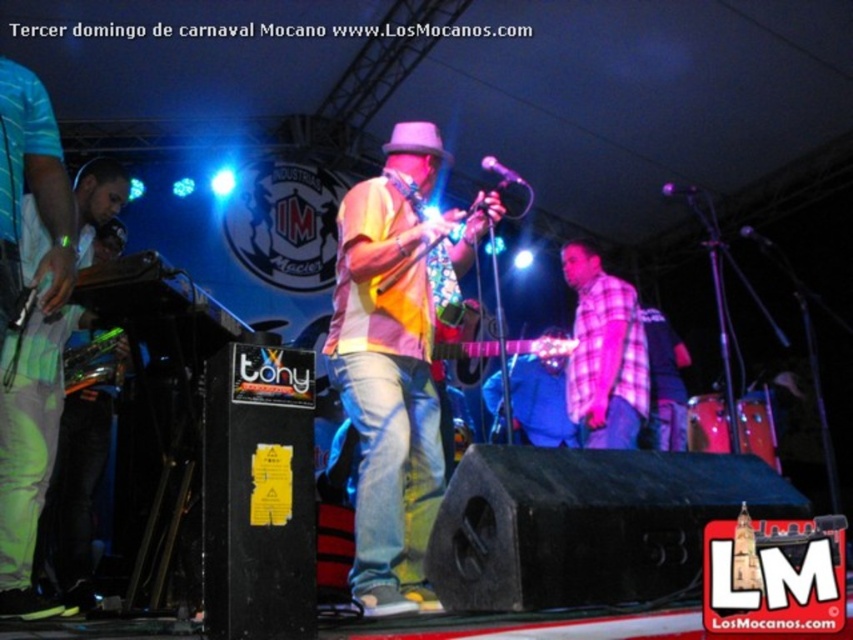
You are a photographer at the carnival event. You see two performers wearing a multicolored fabric shirt at center and a pink plaid shirt at center. Which shirt is larger in size?

The multicolored fabric shirt at center is bigger than the pink plaid shirt at center, so the multicolored fabric shirt at center is larger in size.